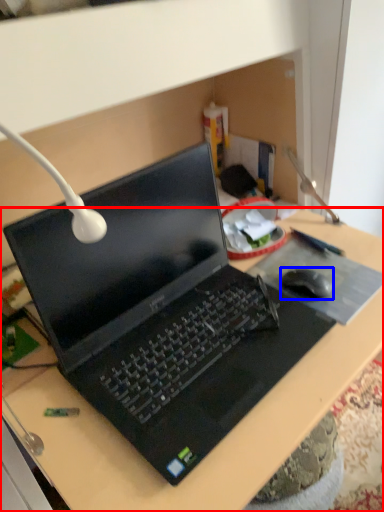
Question: Which object is further to the camera taking this photo, desk (highlighted by a red box) or mouse (highlighted by a blue box)?

Choices:
 (A) desk
 (B) mouse

Answer: (B)